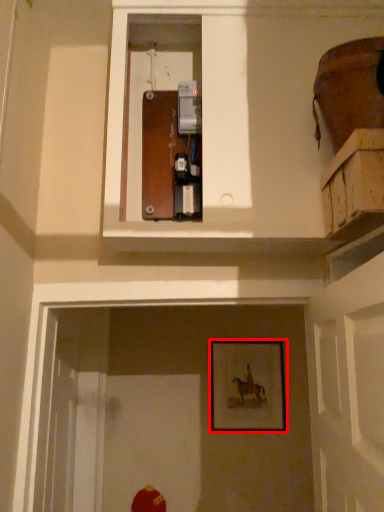
Question: Considering the relative positions of picture frame (annotated by the red box) and cabinetry in the image provided, where is picture frame (annotated by the red box) located with respect to the staircase?

Choices:
 (A) right
 (B) left

Answer: (B)